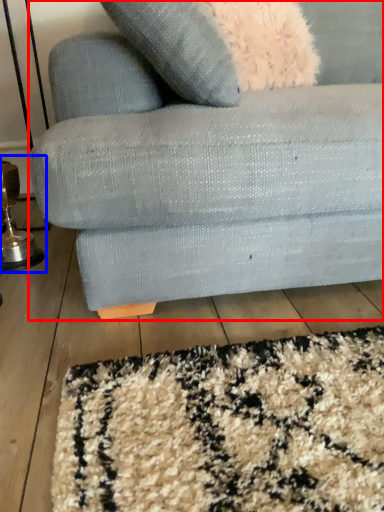
Question: Which object appears farthest to the camera in this image, studio couch (highlighted by a red box) or table lamp (highlighted by a blue box)?

Choices:
 (A) studio couch
 (B) table lamp

Answer: (B)